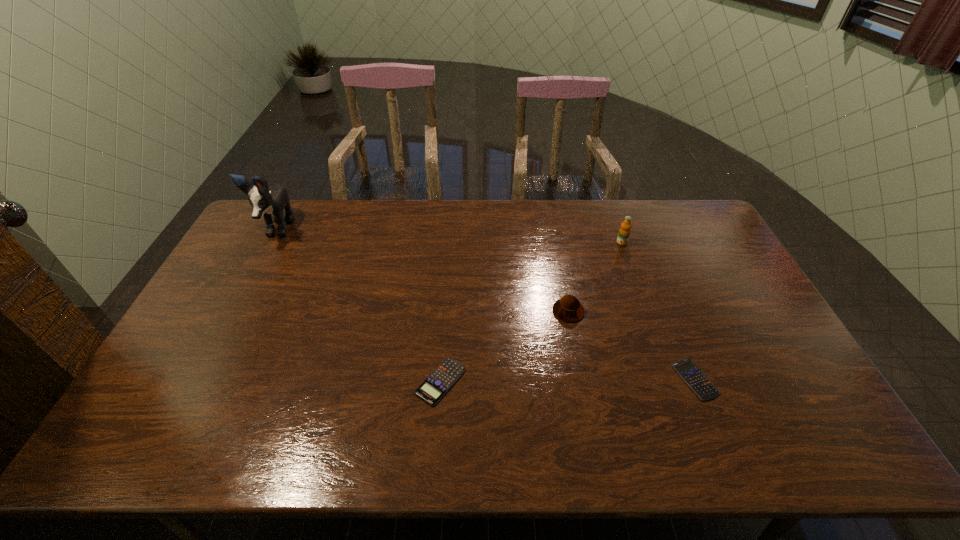
Where is `free space between the third object from left to right and the second shortest object`? This screenshot has width=960, height=540. free space between the third object from left to right and the second shortest object is located at coordinates (504, 346).

Locate an element on the screen. the fourth closest object to the puppy is located at coordinates (692, 375).

Select which object is the second closest to the orange juice. Please provide its 2D coordinates. Your answer should be formatted as a tuple, i.e. [(x, y)], where the tuple contains the x and y coordinates of a point satisfying the conditions above.

[(692, 375)]

Locate an element on the screen. vacant region that satisfies the following two spatial constraints: 1. on the front-facing side of the puppy; 2. on the right side of the shortest object is located at coordinates (196, 379).

This screenshot has width=960, height=540. I want to click on free spot that satisfies the following two spatial constraints: 1. on the back side of the left calculator; 2. on the right side of the shortest object, so click(441, 379).

Identify the location of vacant space that satisfies the following two spatial constraints: 1. on the front-facing side of the shortest object; 2. on the left side of the puppy. (196, 379).

Find the location of `free space that satisfies the following two spatial constraints: 1. on the front-facing side of the leftmost object; 2. on the right side of the shorter calculator`. free space that satisfies the following two spatial constraints: 1. on the front-facing side of the leftmost object; 2. on the right side of the shorter calculator is located at coordinates (196, 379).

This screenshot has width=960, height=540. In order to click on vacant point that satisfies the following two spatial constraints: 1. on the front-facing side of the shorter calculator; 2. on the left side of the puppy in this screenshot , I will do `click(196, 379)`.

Where is `vacant point that satisfies the following two spatial constraints: 1. on the back side of the second object from left to right; 2. on the right side of the muffin`? Image resolution: width=960 pixels, height=540 pixels. vacant point that satisfies the following two spatial constraints: 1. on the back side of the second object from left to right; 2. on the right side of the muffin is located at coordinates (445, 311).

Locate an element on the screen. Image resolution: width=960 pixels, height=540 pixels. free spot that satisfies the following two spatial constraints: 1. on the front-facing side of the left calculator; 2. on the left side of the puppy is located at coordinates (195, 382).